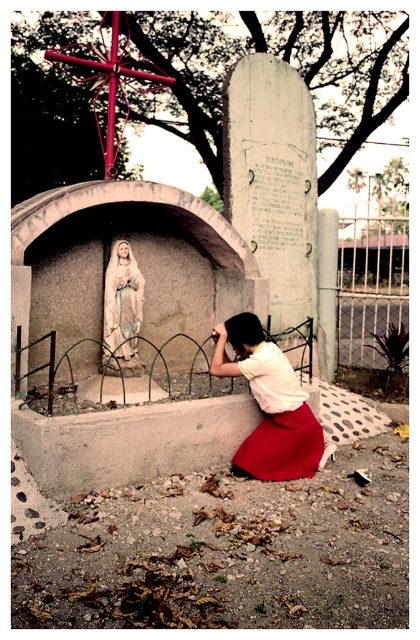
Between point (249, 520) and point (121, 368), which one is positioned in front?

Point (249, 520) is in front.

Between point (147, 518) and point (130, 305), which one is positioned behind?

The point (130, 305) is more distant.

The height and width of the screenshot is (640, 420). In order to click on smooth concrete base at lower center in this screenshot , I will do `click(228, 552)`.

Between matte white blouse at center and white marble statue at center, which one has more height?

Standing taller between the two is matte white blouse at center.

Can you confirm if matte white blouse at center is shorter than white marble statue at center?

In fact, matte white blouse at center may be taller than white marble statue at center.

I want to click on matte white blouse at center, so click(x=268, y=403).

Does smooth concrete base at lower center have a greater width compared to matte white blouse at center?

Indeed, smooth concrete base at lower center has a greater width compared to matte white blouse at center.

Is smooth concrete base at lower center to the left of matte white blouse at center from the viewer's perspective?

Incorrect, smooth concrete base at lower center is not on the left side of matte white blouse at center.

Is point (181, 563) farther from viewer compared to point (236, 314)?

No, (181, 563) is in front of (236, 314).

Identify the location of smooth concrete base at lower center. The width and height of the screenshot is (420, 640). (228, 552).